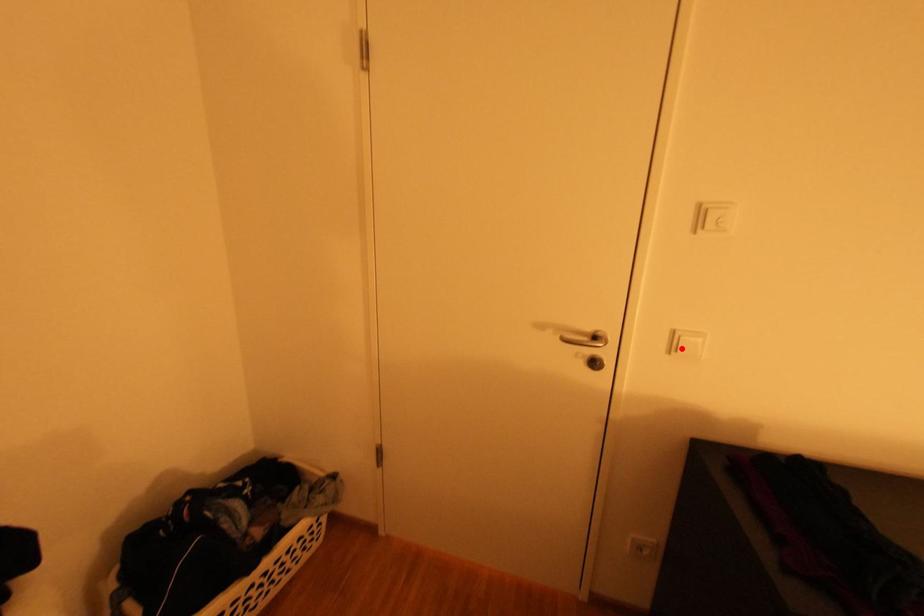
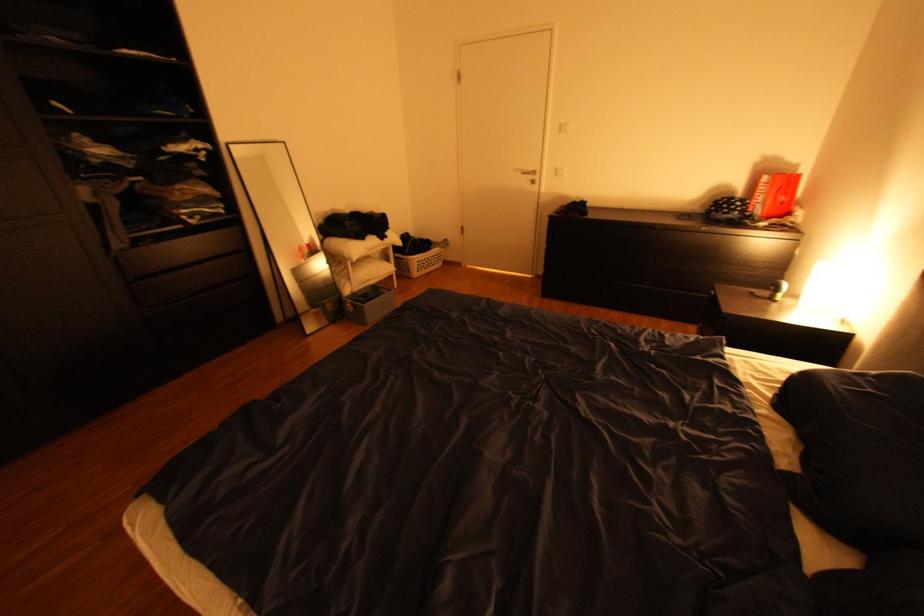
Locate, in the second image, the point that corresponds to the highlighted location in the first image.

(565, 174)